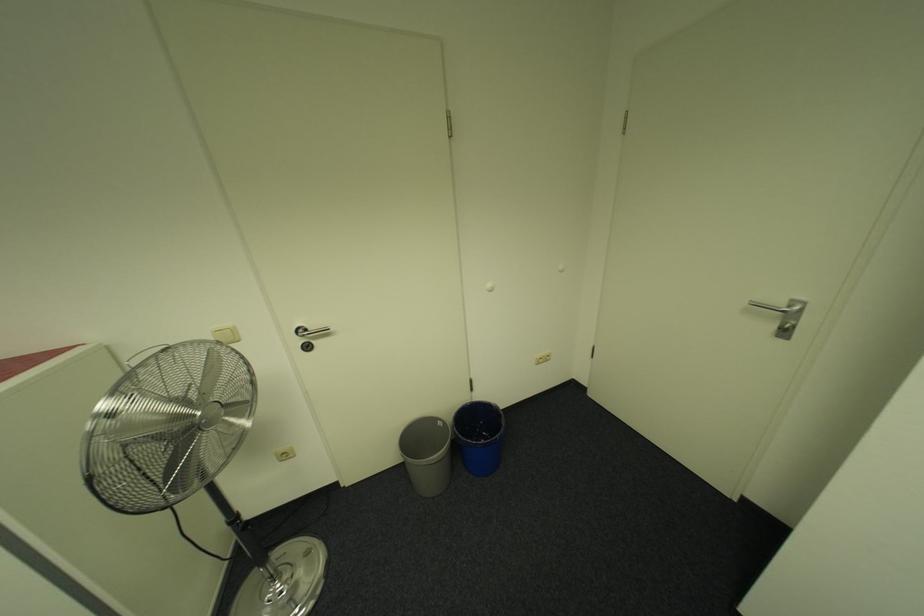
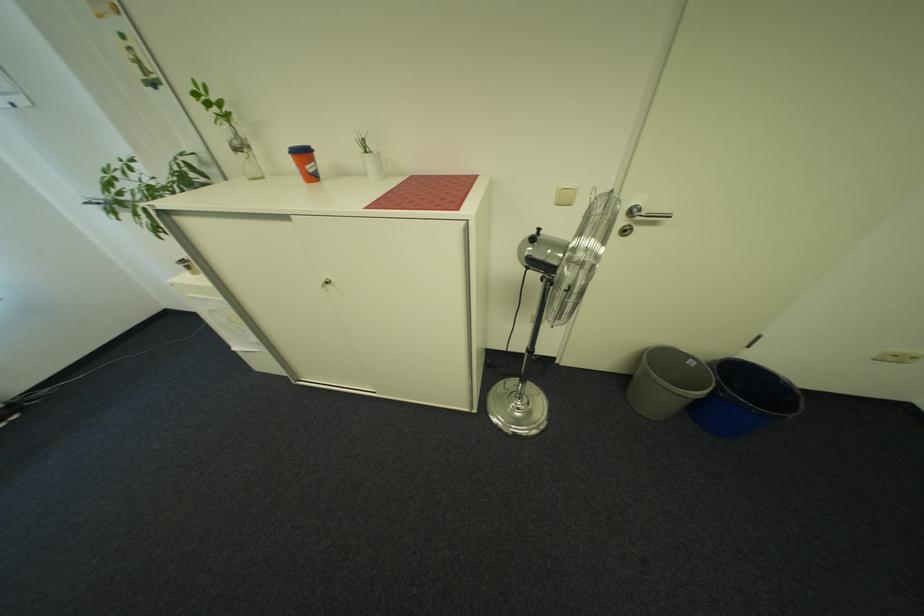
In the second image, find the point that corresponds to point (448, 424) in the first image.

(700, 363)